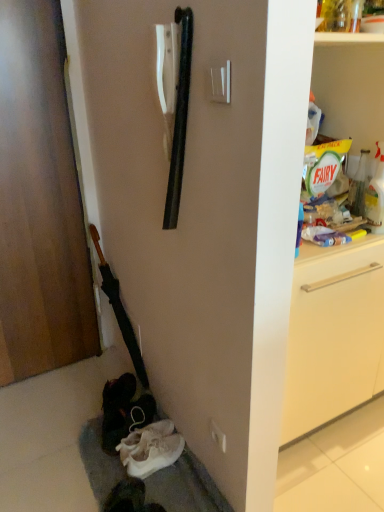
Question: From a real-world perspective, is white plastic electric outlet at center on white suede shoe at lower left?

Choices:
 (A) yes
 (B) no

Answer: (A)

Question: Are white plastic electric outlet at center and white suede shoe at lower left located far from each other?

Choices:
 (A) yes
 (B) no

Answer: (B)

Question: Is white suede shoe at lower left completely or partially inside white plastic electric outlet at center?

Choices:
 (A) yes
 (B) no

Answer: (B)

Question: Can we say white plastic electric outlet at center lies outside white suede shoe at lower left?

Choices:
 (A) yes
 (B) no

Answer: (A)

Question: Considering the relative sizes of white plastic electric outlet at center and white suede shoe at lower left in the image provided, is white plastic electric outlet at center taller than white suede shoe at lower left?

Choices:
 (A) no
 (B) yes

Answer: (A)

Question: From a real-world perspective, is white plastic electric outlet at center below white suede shoe at lower left?

Choices:
 (A) yes
 (B) no

Answer: (B)

Question: From a real-world perspective, is wooden door at left physically below white plastic electric outlet at center?

Choices:
 (A) yes
 (B) no

Answer: (B)

Question: Can you confirm if wooden door at left is shorter than white plastic electric outlet at center?

Choices:
 (A) no
 (B) yes

Answer: (A)

Question: Are wooden door at left and white plastic electric outlet at center far apart?

Choices:
 (A) yes
 (B) no

Answer: (A)

Question: Would you say wooden door at left contains white plastic electric outlet at center?

Choices:
 (A) yes
 (B) no

Answer: (B)

Question: Is wooden door at left positioned behind white plastic electric outlet at center?

Choices:
 (A) yes
 (B) no

Answer: (B)

Question: Could you tell me if wooden door at left is turned towards white plastic electric outlet at center?

Choices:
 (A) no
 (B) yes

Answer: (B)

Question: Can you confirm if white fabric shoes at lower left is wider than white plastic electric outlet at center?

Choices:
 (A) yes
 (B) no

Answer: (A)